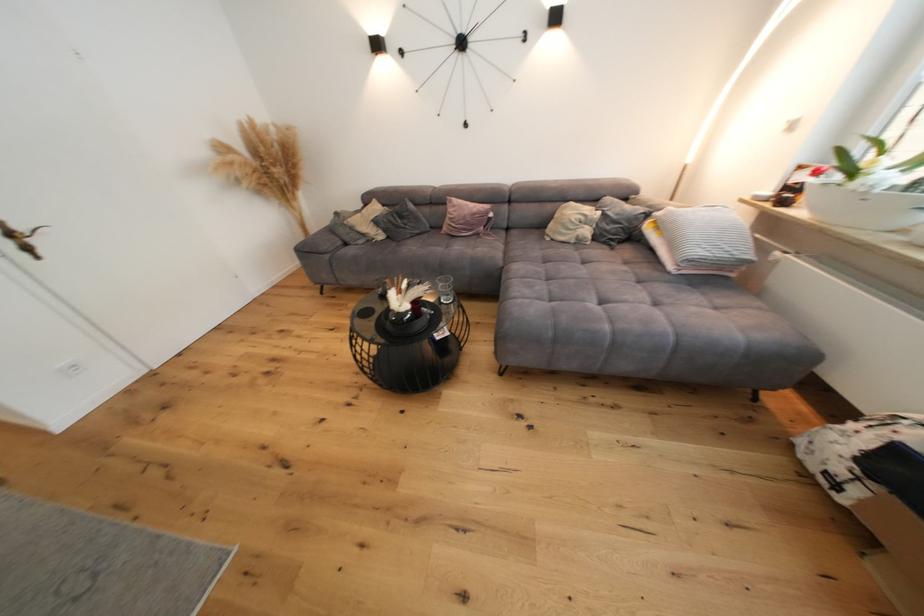
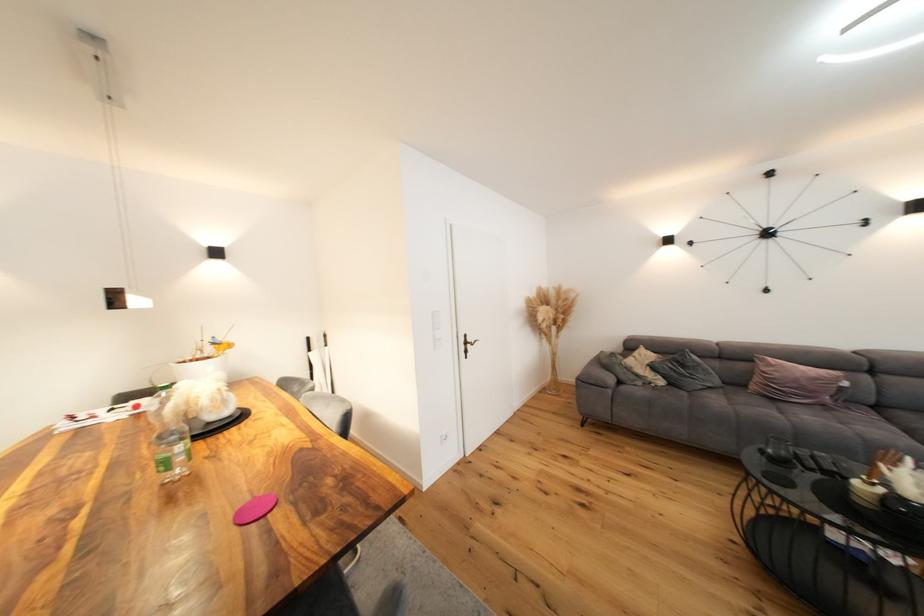
Find the pixel in the second image that matches pixel 408 219 in the first image.

(690, 368)